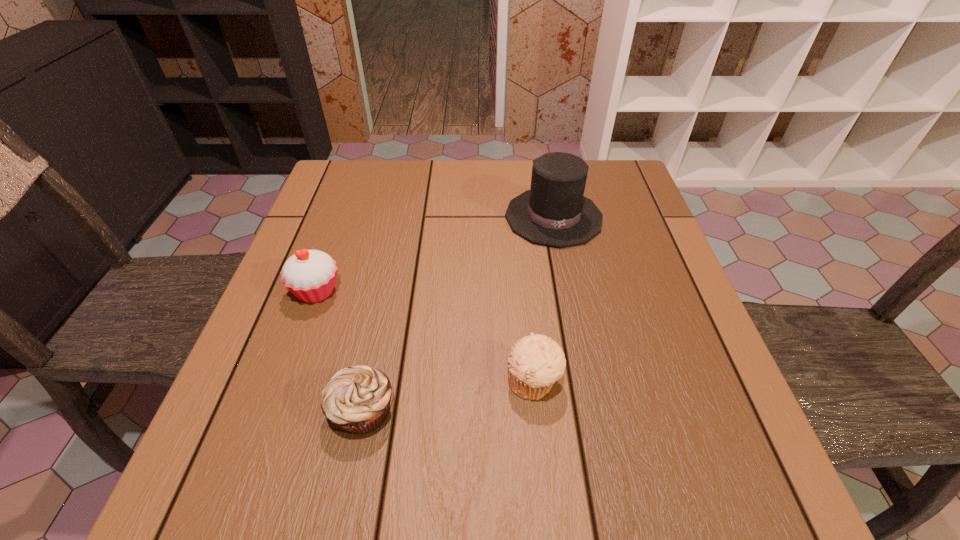
Locate an element on the screen. The width and height of the screenshot is (960, 540). dress hat is located at coordinates 554,212.

At what (x,y) coordinates should I click in order to perform the action: click on the tallest object. Please return your answer as a coordinate pair (x, y). Looking at the image, I should click on (554, 212).

The image size is (960, 540). I want to click on the second farthest object, so click(310, 275).

In order to click on the second tallest object in this screenshot , I will do `click(310, 275)`.

Locate an element on the screen. the right muffin is located at coordinates (536, 362).

At what (x,y) coordinates should I click in order to perform the action: click on the left muffin. Please return your answer as a coordinate pair (x, y). The height and width of the screenshot is (540, 960). Looking at the image, I should click on (357, 399).

This screenshot has width=960, height=540. Identify the location of vacant area situated 0.370m on the front of the tallest object with the decoration. (587, 387).

Where is `blank area located on the right of the leftmost object`? The height and width of the screenshot is (540, 960). blank area located on the right of the leftmost object is located at coordinates (380, 291).

Find the location of `vacant space situated on the right of the right muffin`. vacant space situated on the right of the right muffin is located at coordinates (667, 382).

The height and width of the screenshot is (540, 960). What are the coordinates of `vacant space located 0.290m on the back of the third object from right to left` in the screenshot? It's located at (392, 269).